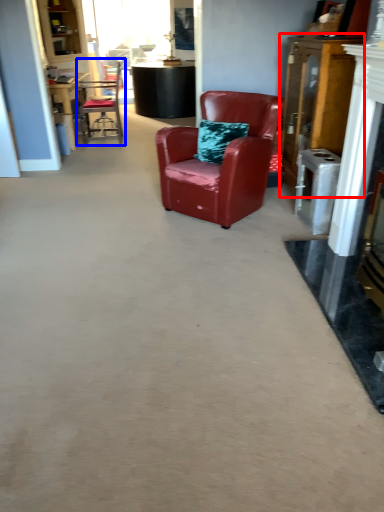
Question: Among these objects, which one is nearest to the camera, dresser (highlighted by a red box) or chair (highlighted by a blue box)?

Choices:
 (A) dresser
 (B) chair

Answer: (A)